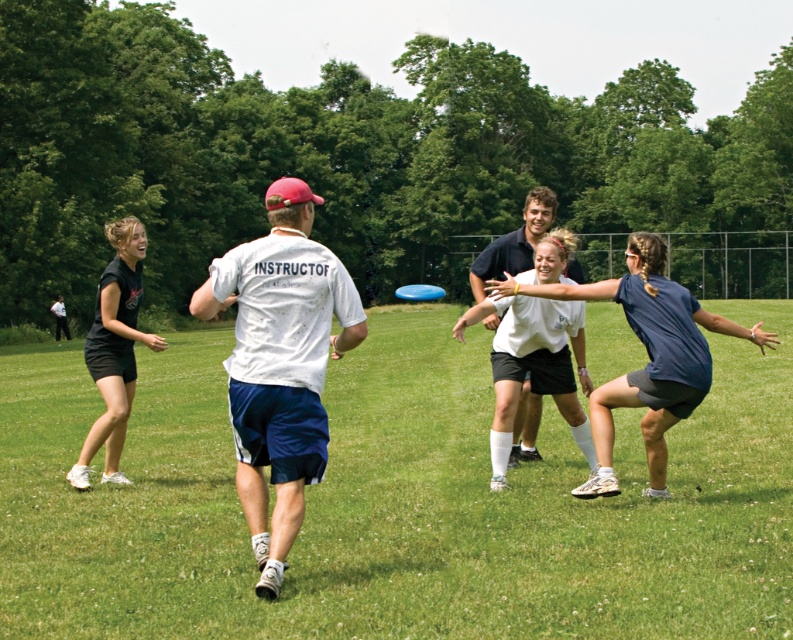
In the ultimate frisbee scene, you notice the black matte shorts at left and the white smooth shirt at center. Which object takes up more space in the image?

The white smooth shirt at center takes up more space than the black matte shorts at left.

You are a participant in the ultimate frisbee game and need to locate the black matte shorts at left. Based on the coordinates provided, where would you look relative to your position in the scene?

The black matte shorts at left are located at the coordinates point [113,348], which means they are positioned approximately 54.5 percent from the left edge and 14.5 percent from the bottom edge of the scene.